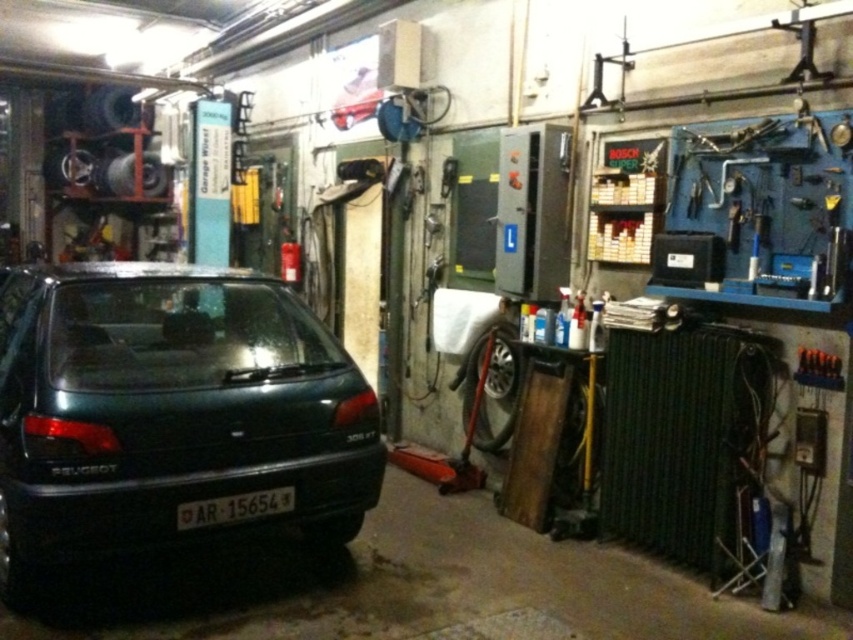
Who is positioned more to the right, green matte car at left or white plastic license plate at center?

From the viewer's perspective, white plastic license plate at center appears more on the right side.

Is green matte car at left positioned before white plastic license plate at center?

That is True.

Is point (230, 428) behind point (229, 512)?

That is False.

Locate an element on the screen. green matte car at left is located at coordinates (167, 412).

Is white plastic license plate at center in front of metallic orange tool at right?

That is True.

Is white plastic license plate at center smaller than metallic orange tool at right?

Incorrect, white plastic license plate at center is not smaller in size than metallic orange tool at right.

Between point (231, 506) and point (827, 364), which one is positioned behind?

Point (827, 364)

Identify the location of white plastic license plate at center. (234, 508).

Which is behind, point (3, 320) or point (801, 369)?

Point (3, 320)

Does point (177, 266) come farther from viewer compared to point (815, 353)?

Yes, it is.

The width and height of the screenshot is (853, 640). What are the coordinates of `green matte car at left` in the screenshot? It's located at (167, 412).